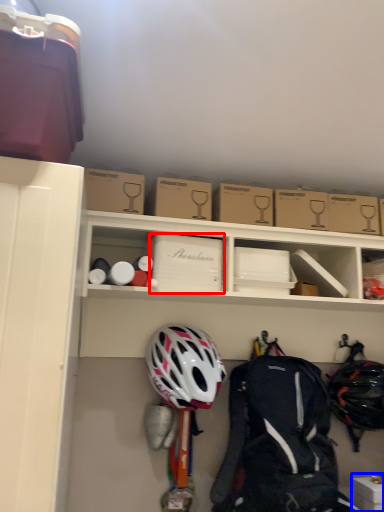
Question: Among these objects, which one is nearest to the camera, cardboard box (highlighted by a red box) or storage box (highlighted by a blue box)?

Choices:
 (A) cardboard box
 (B) storage box

Answer: (B)